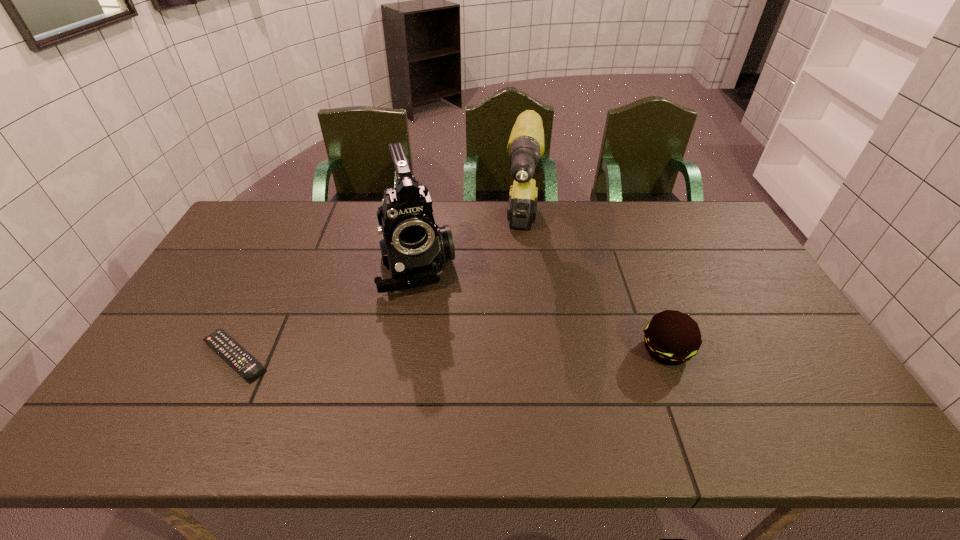
You are a GUI agent. You are given a task and a screenshot of the screen. Output one action in this format:
    pyautogui.click(x=<x>, y=<y>)
    Task: Click on the vacant space on the desktop that is between the leftmost object and the second shortest object and is positioned on the lens mount of the second object from left to right
    Image resolution: width=960 pixels, height=540 pixels.
    Given the screenshot: What is the action you would take?
    pyautogui.click(x=443, y=353)

You are a GUI agent. You are given a task and a screenshot of the screen. Output one action in this format:
    pyautogui.click(x=<x>, y=<y>)
    Task: Click on the free space on the desktop that is between the shortest object and the rightmost object and is positioned on the handle side of the drill
    
    Given the screenshot: What is the action you would take?
    pyautogui.click(x=509, y=352)